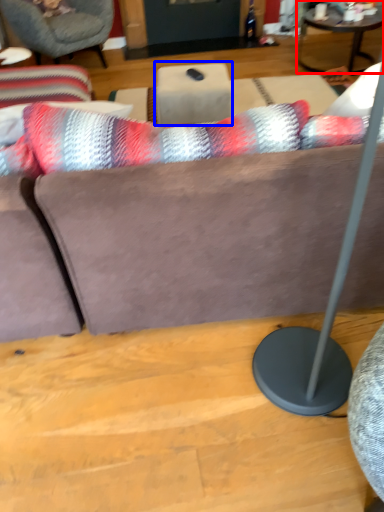
Question: Which of the following is the farthest to the observer, coffee table (highlighted by a red box) or table (highlighted by a blue box)?

Choices:
 (A) coffee table
 (B) table

Answer: (A)